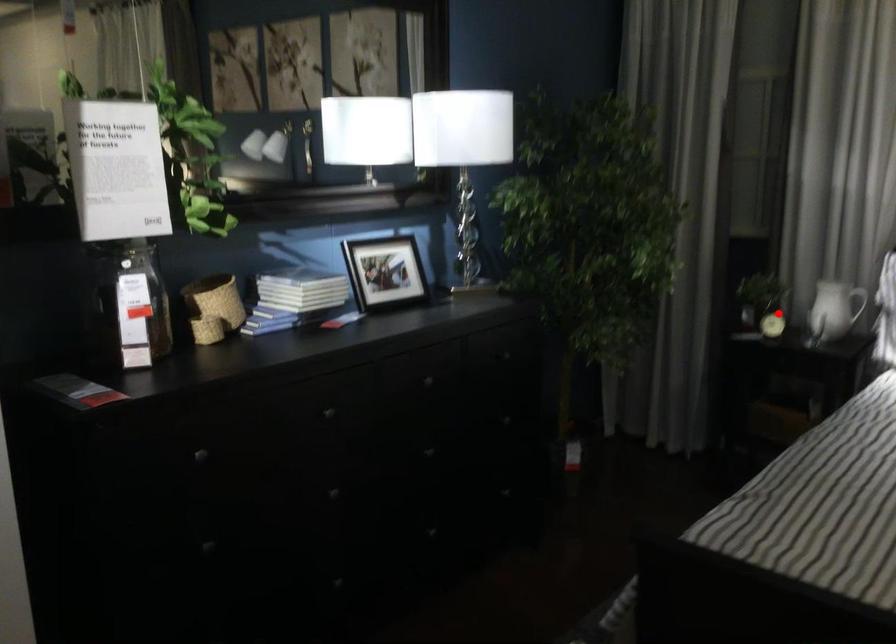
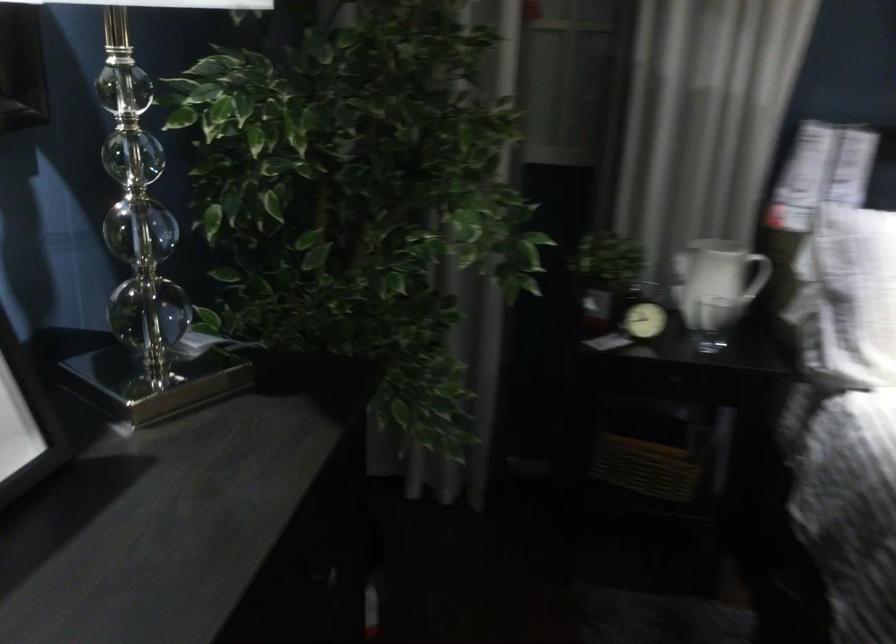
In the second image, find the point that corresponds to the highlighted location in the first image.

(643, 321)